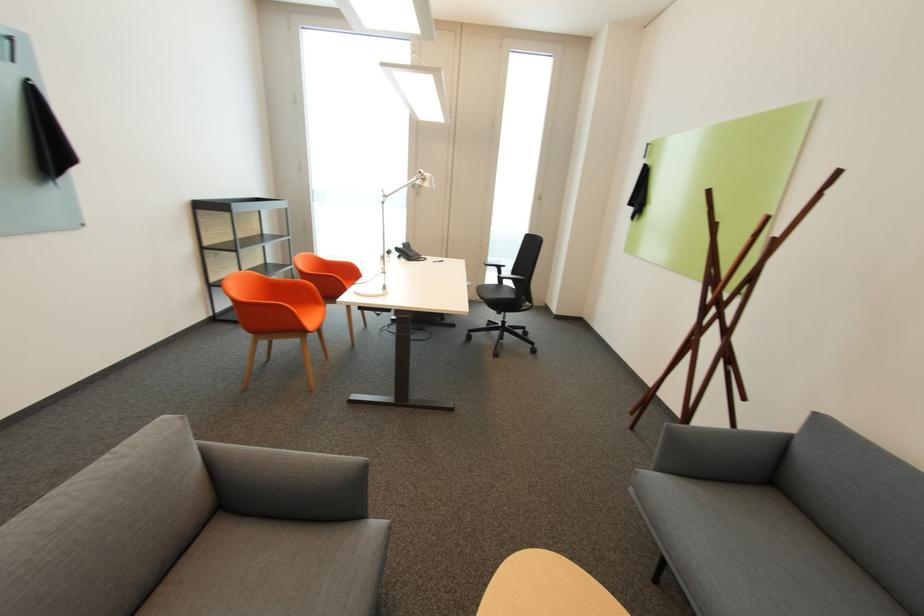
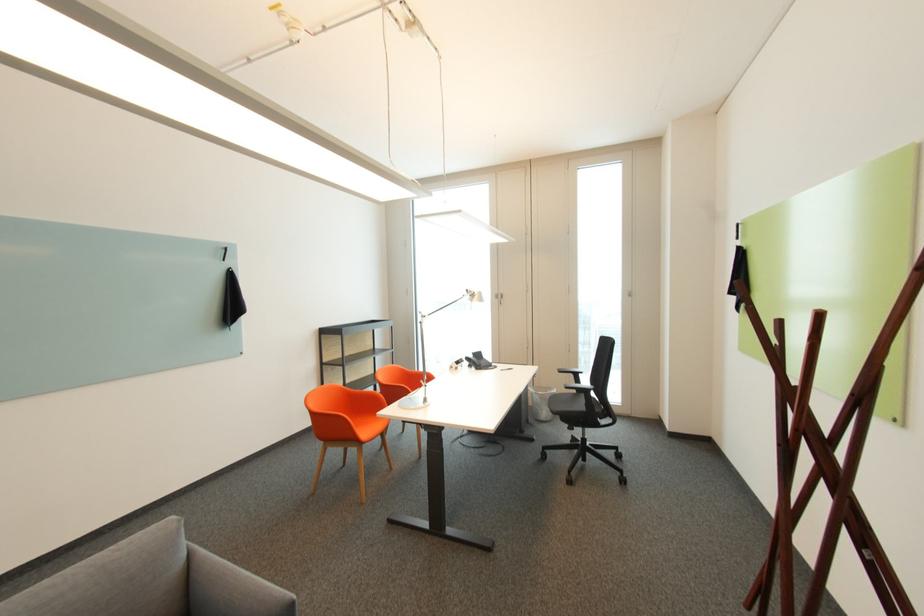
Question: In a continuous first-person perspective shot, in which direction is the camera moving?

Choices:
 (A) Left
 (B) Right
 (C) Forward
 (D) Backward

Answer: (B)